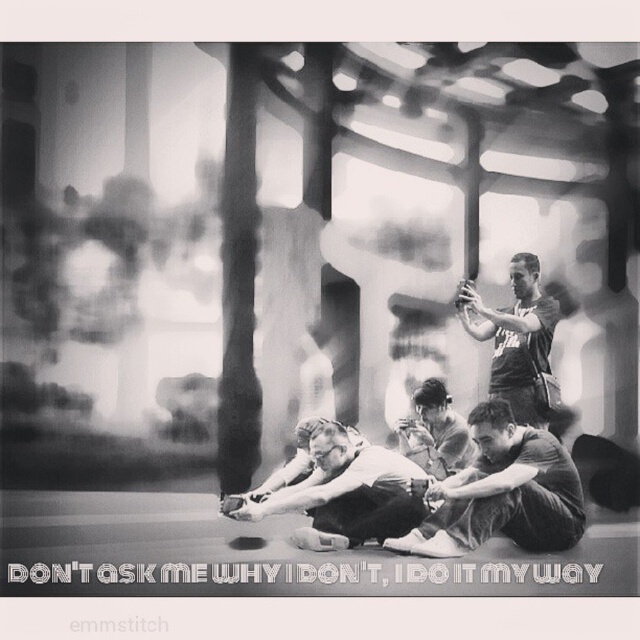
Question: Considering the real-world distances, which object is closest to the dark gray fabric shirt at lower right?

Choices:
 (A) smooth fabric shirt at center
 (B) white fabric shirt at center
 (C) dark gray t-shirt at upper right

Answer: (A)

Question: Does dark gray fabric shirt at lower right appear on the right side of smooth fabric shirt at center?

Choices:
 (A) yes
 (B) no

Answer: (A)

Question: Is dark gray fabric shirt at lower right above smooth fabric shirt at center?

Choices:
 (A) no
 (B) yes

Answer: (A)

Question: Which point is closer to the camera taking this photo?

Choices:
 (A) (435, 452)
 (B) (369, 499)
 (C) (556, 316)
 (D) (566, 541)

Answer: (B)

Question: Can you confirm if dark gray fabric shirt at lower right is positioned above white fabric shirt at center?

Choices:
 (A) no
 (B) yes

Answer: (A)

Question: Which point is farther from the camera taking this photo?

Choices:
 (A) (506, 497)
 (B) (422, 417)

Answer: (B)